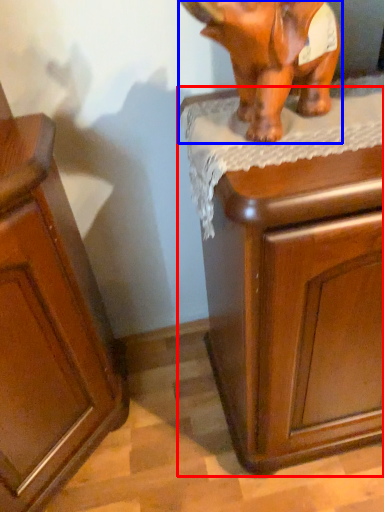
Question: Which object is further to the camera taking this photo, chest of drawers (highlighted by a red box) or elephant (highlighted by a blue box)?

Choices:
 (A) chest of drawers
 (B) elephant

Answer: (A)